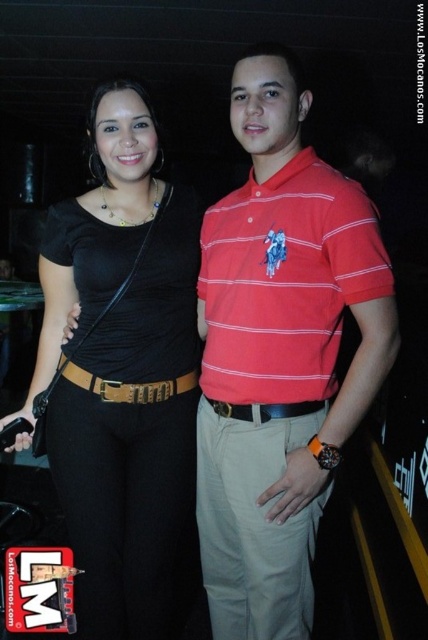
Between matte red polo shirt at center and brown leather belt at center, which one is positioned lower?

Positioned lower is brown leather belt at center.

Measure the distance between matte red polo shirt at center and camera.

1.19 meters

At what (x,y) coordinates should I click in order to perform the action: click on matte red polo shirt at center. Please return your answer as a coordinate pair (x, y). Image resolution: width=428 pixels, height=640 pixels. Looking at the image, I should click on (279, 355).

Locate an element on the screen. The image size is (428, 640). matte red polo shirt at center is located at coordinates (279, 355).

Does red striped polo shirt at center have a lesser height compared to brown leather belt at center?

In fact, red striped polo shirt at center may be taller than brown leather belt at center.

Is red striped polo shirt at center further to camera compared to brown leather belt at center?

No, it is in front of brown leather belt at center.

What do you see at coordinates (285, 282) in the screenshot?
I see `red striped polo shirt at center` at bounding box center [285, 282].

Where is `red striped polo shirt at center`? The height and width of the screenshot is (640, 428). red striped polo shirt at center is located at coordinates (285, 282).

Which is more to the left, matte red polo shirt at center or red striped polo shirt at center?

matte red polo shirt at center

Measure the distance from matte red polo shirt at center to red striped polo shirt at center.

The distance of matte red polo shirt at center from red striped polo shirt at center is 2.54 inches.

What do you see at coordinates (279, 355) in the screenshot? The image size is (428, 640). I see `matte red polo shirt at center` at bounding box center [279, 355].

The image size is (428, 640). Find the location of `matte red polo shirt at center`. matte red polo shirt at center is located at coordinates (279, 355).